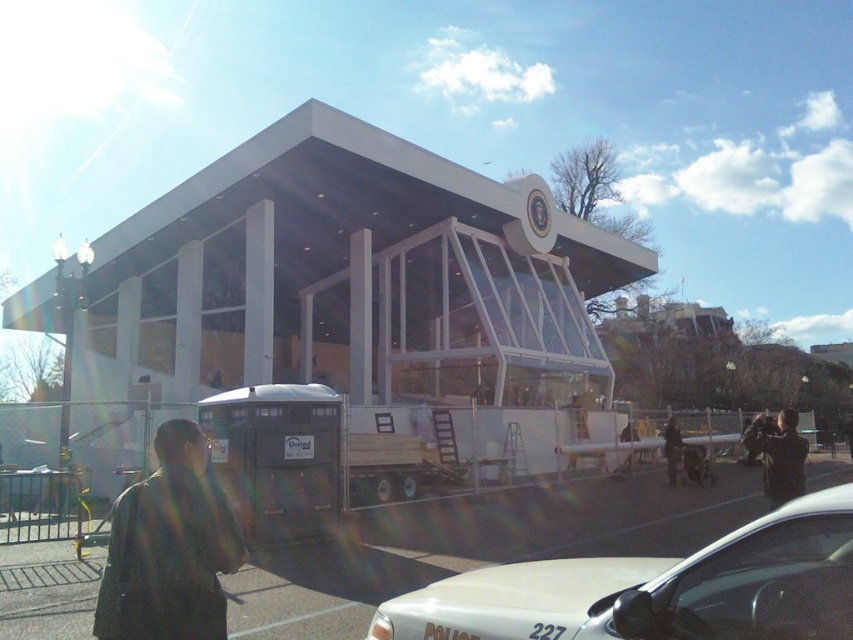
You are a construction worker standing at the fence near the portable restroom unit with a dark exterior and a white sign displaying United. You need to reach the white glossy police car at lower center. Which direction should you move relative to the dark brown leather jacket at lower left?

The white glossy police car at lower center is positioned under the dark brown leather jacket at lower left, so you should move downward from the dark brown leather jacket at lower left to reach the white glossy police car at lower center.

Consider the image. You are a construction worker standing near the white glossy police car at lower center and the black leather jacket at lower right. Which object is positioned higher in the image?

The white glossy police car at lower center is above the black leather jacket at lower right, so it is positioned higher in the image.

You are a construction worker standing near the portable restroom unit. You need to move the white glossy police car at lower center and the dark brown leather jacket at lower left to a storage area. Which object should you move first if you want to carry the taller item first?

The dark brown leather jacket at lower left is taller than the white glossy police car at lower center, so you should move the dark brown leather jacket at lower left first.